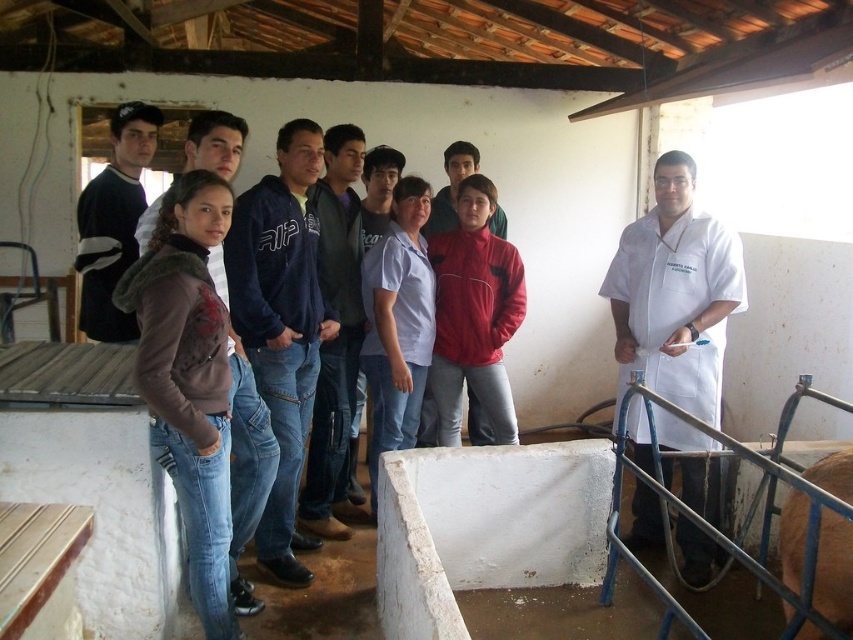
Does dark blue jersey at center have a smaller size compared to matte blue hoodie at center?

Incorrect, dark blue jersey at center is not smaller in size than matte blue hoodie at center.

Is dark blue jersey at center to the right of matte blue hoodie at center from the viewer's perspective?

In fact, dark blue jersey at center is to the left of matte blue hoodie at center.

Who is more forward, (96,246) or (451,176)?

Positioned in front is point (96,246).

Where is `dark blue jersey at center`? This screenshot has width=853, height=640. dark blue jersey at center is located at coordinates (113, 221).

Does point (289, 252) lie behind point (119, 145)?

No, it is not.

Identify the location of dark blue hoodie at center. (281, 321).

Find the location of `dark blue hoodie at center`. dark blue hoodie at center is located at coordinates (281, 321).

Does point (699, 275) come farther from viewer compared to point (334, 396)?

No.

Between white lab coat at right and blue denim jeans at center, which one has more height?

blue denim jeans at center is taller.

In order to click on white lab coat at right in this screenshot , I will do `click(675, 292)`.